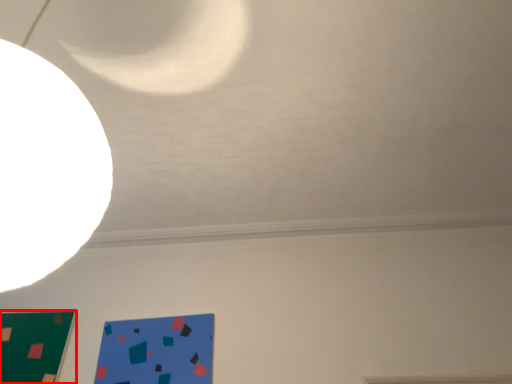
Question: Observing the image, what is the correct spatial positioning of rectangle (annotated by the red box) in reference to design?

Choices:
 (A) right
 (B) left

Answer: (B)